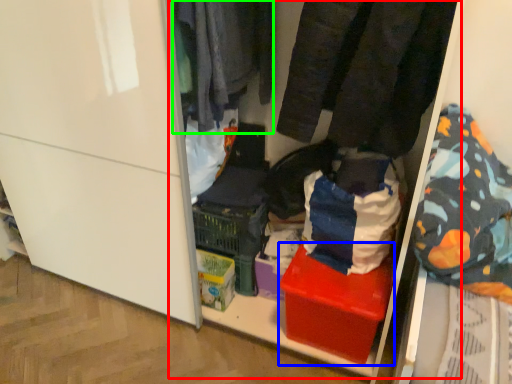
Question: Which object is the closest to the shelf (highlighted by a red box)? Choose among these: box (highlighted by a blue box) or clothing (highlighted by a green box).

Choices:
 (A) box
 (B) clothing

Answer: (B)